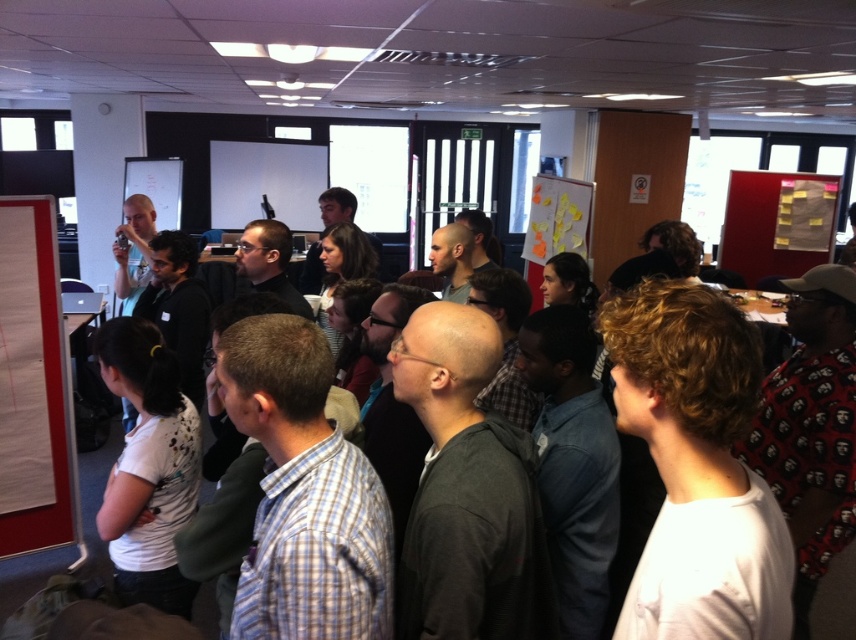
Is point (129, 371) positioned behind point (3, 228)?

No, it is not.

Which is below, white matte shirt at lower left or white paper at left?

white matte shirt at lower left is lower down.

Locate an element on the screen. This screenshot has height=640, width=856. white matte shirt at lower left is located at coordinates (147, 467).